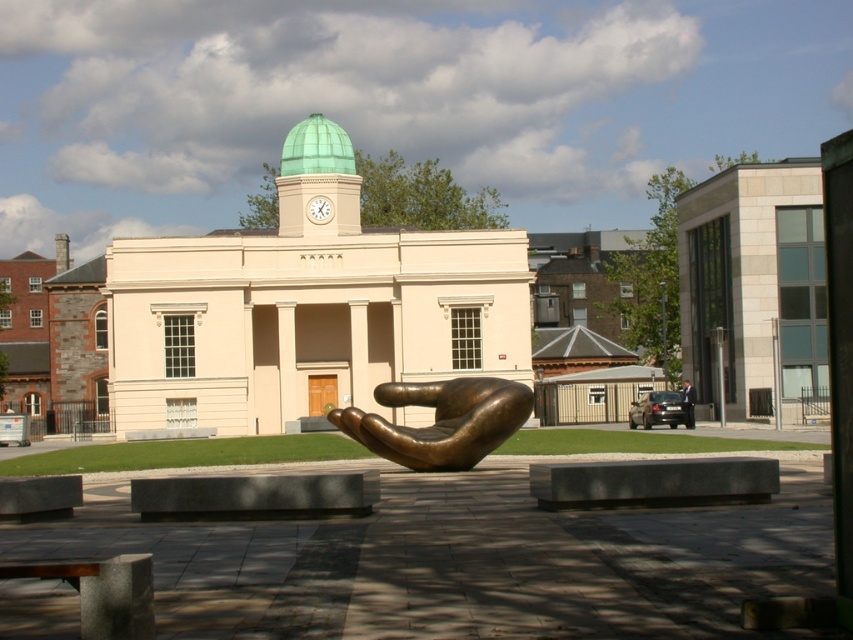
You are standing in the public square and see the bronze hand at center and the dark suit at center. Which object is positioned to the left?

The bronze hand at center is positioned to the left of the dark suit at center.

You are standing at point (440, 420) in the public square. Looking around, you see the bronze hand at center. Which direction should you walk to reach the classical building with the clock tower?

The bronze hand at center is located at point (440, 420). To reach the classical building with the clock tower, you should walk to the left since the building is positioned to the right of the bronze hand at center according to the scene description.

You are standing in the public square and want to take a photo of the bronze hand at center. Where should you position yourself to capture the sculpture in the center of your camera frame?

The bronze hand at center is located at point 2D coordinates [440,420], so you should position yourself directly in front of it to ensure it appears centered in your camera frame.